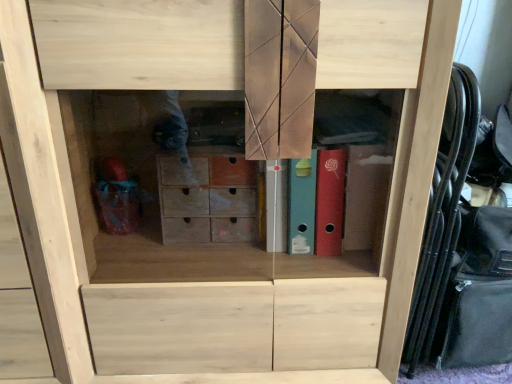
This screenshot has width=512, height=384. What do you see at coordinates (443, 215) in the screenshot?
I see `black leather chair at right` at bounding box center [443, 215].

Locate an element on the screen. The height and width of the screenshot is (384, 512). black leather chair at right is located at coordinates (443, 215).

Find the location of a particular element. The width and height of the screenshot is (512, 384). black leather chair at right is located at coordinates (443, 215).